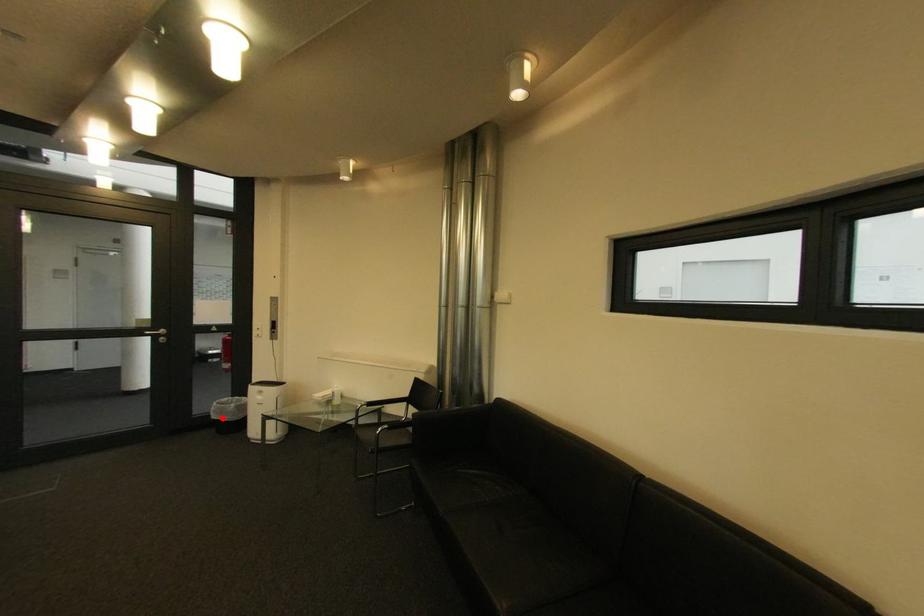
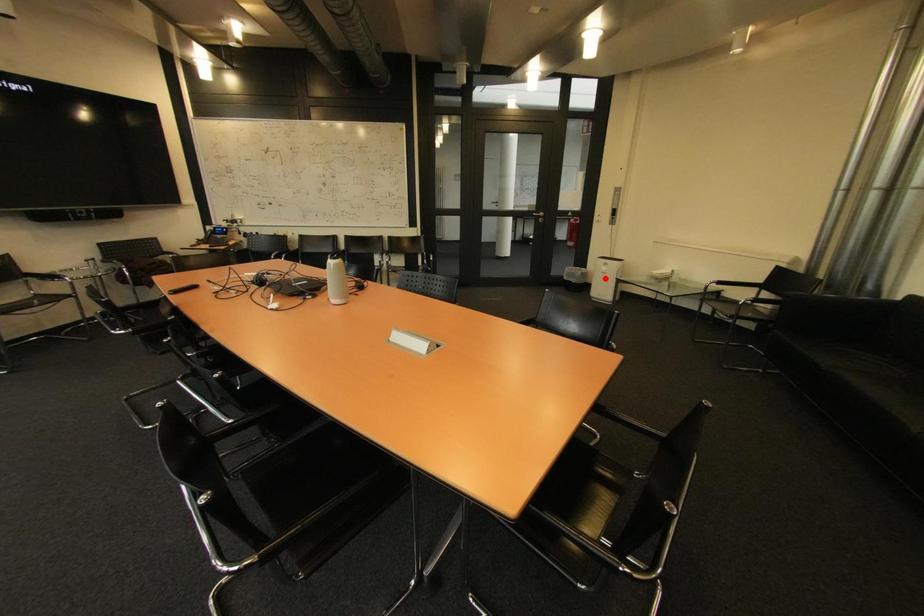
I am providing you with two images of the same scene from different viewpoints. A red point is marked on the first image and another point is marked on the second image. Do the highlighted points in image1 and image2 indicate the same real-world spot?

No